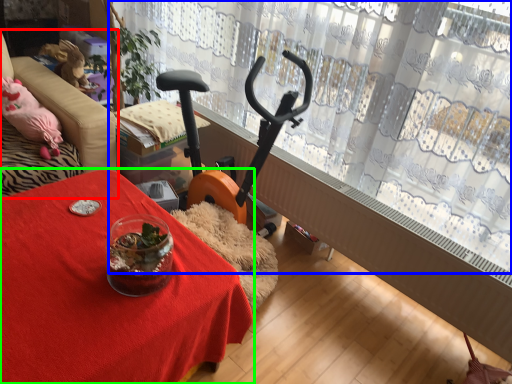
Question: Which object is positioned farthest from furniture (highlighted by a red box)? Select from curtain (highlighted by a blue box) and table (highlighted by a green box).

Choices:
 (A) curtain
 (B) table

Answer: (A)